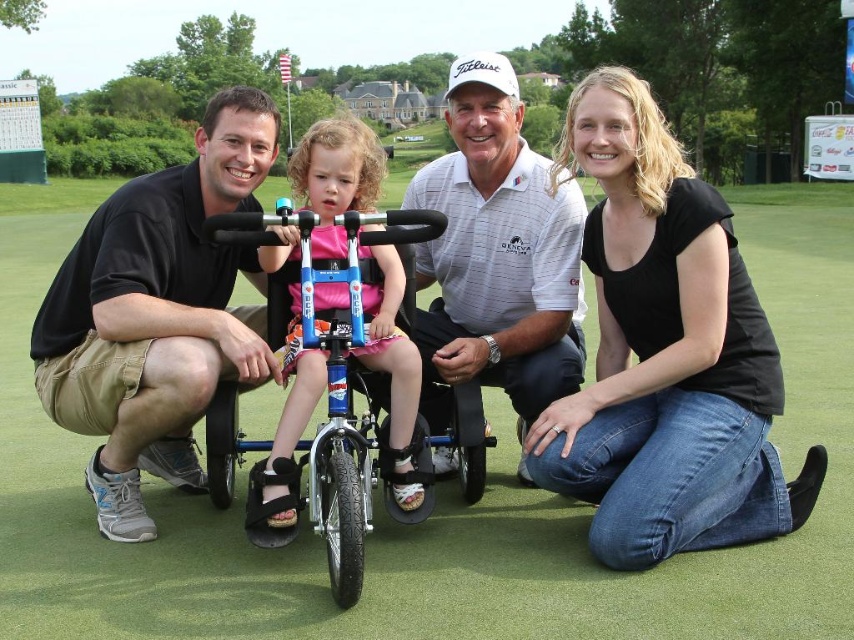
You are standing at the camera position and want to throw a ball to the point marked at coordinates point (436, 346). Can you estimate how far you need to throw the ball to reach that point?

The distance between the camera and point (436, 346) is 12.40 meters, so you need to throw the ball approximately 12.40 meters to reach that point.